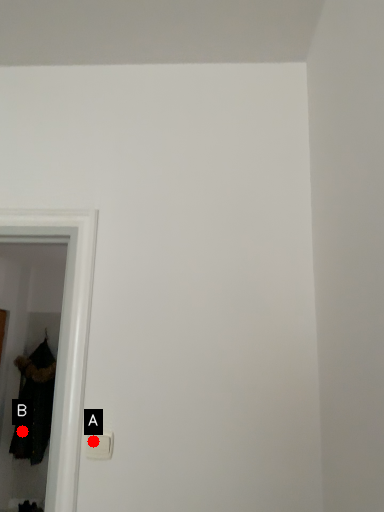
Question: Two points are circled on the image, labeled by A and B beside each circle. Which point is closer to the camera?

Choices:
 (A) A is closer
 (B) B is closer

Answer: (A)